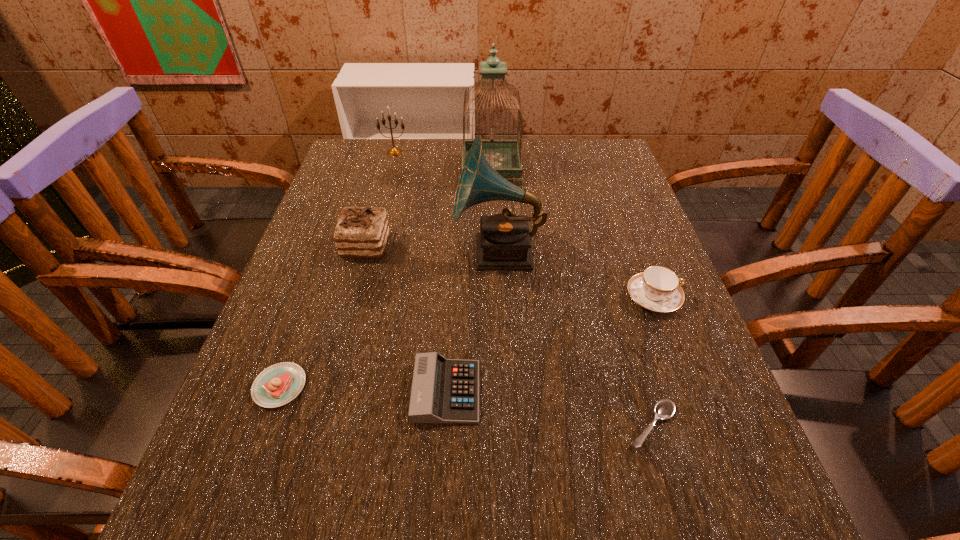
Locate an element on the screen. candelabrum at the far edge is located at coordinates (393, 151).

You are a GUI agent. You are given a task and a screenshot of the screen. Output one action in this format:
    pyautogui.click(x=<x>, y=<y>)
    Task: Click on the candelabrum located at the left edge
    This screenshot has height=540, width=960.
    Given the screenshot: What is the action you would take?
    pyautogui.click(x=393, y=151)

Locate an element on the screen. The height and width of the screenshot is (540, 960). chocolate cake at the left edge is located at coordinates (362, 232).

Where is `pastry that is at the left edge`? The image size is (960, 540). pastry that is at the left edge is located at coordinates (277, 385).

Identify the location of teacup located in the right edge section of the desktop. The width and height of the screenshot is (960, 540). (657, 289).

The height and width of the screenshot is (540, 960). Find the location of `soupspoon that is at the right edge`. soupspoon that is at the right edge is located at coordinates (664, 409).

Where is `object that is at the far left corner`? The height and width of the screenshot is (540, 960). object that is at the far left corner is located at coordinates coord(393,151).

Find the location of a particular element. This screenshot has width=960, height=540. free location at the far edge of the desktop is located at coordinates (396, 170).

In the image, there is a desktop. In order to click on free space at the near edge in this screenshot , I will do `click(404, 507)`.

This screenshot has width=960, height=540. I want to click on free space at the left edge, so click(326, 262).